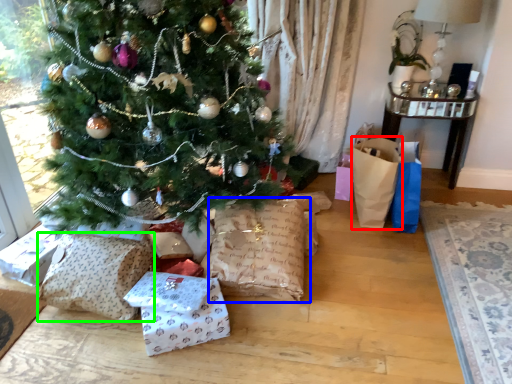
Question: Estimate the real-world distances between objects in this image. Which object is closer to gift bag (highlighted by a red box), sack (highlighted by a blue box) or sack (highlighted by a green box)?

Choices:
 (A) sack
 (B) sack

Answer: (A)